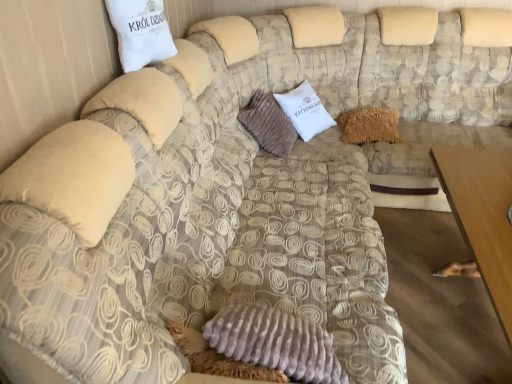
Question: Does fuzzy brown pillow at center, the third pillow in the left-to-right sequence, have a greater height compared to fuzzy brown pillow at center, the second pillow in the back-to-front sequence?

Choices:
 (A) yes
 (B) no

Answer: (B)

Question: Is fuzzy brown pillow at center, the third pillow in the left-to-right sequence, smaller than fuzzy brown pillow at center, the second pillow when ordered from front to back?

Choices:
 (A) no
 (B) yes

Answer: (B)

Question: From the image's perspective, is fuzzy brown pillow at center, the third pillow in the left-to-right sequence, on fuzzy brown pillow at center, arranged as the second pillow when viewed from the left?

Choices:
 (A) yes
 (B) no

Answer: (A)

Question: Is fuzzy brown pillow at center, the third pillow in the left-to-right sequence, shorter than fuzzy brown pillow at center, the second pillow when ordered from front to back?

Choices:
 (A) no
 (B) yes

Answer: (B)

Question: Is fuzzy brown pillow at center, the third pillow in the left-to-right sequence, wider than fuzzy brown pillow at center, the second pillow in the back-to-front sequence?

Choices:
 (A) no
 (B) yes

Answer: (B)

Question: Is fuzzy brown pillow at center, which appears as the 1th pillow when viewed from the back, in front of or behind white cotton pillow at upper left, which appears as the third pillow when viewed from the back, in the image?

Choices:
 (A) front
 (B) behind

Answer: (B)

Question: Based on their positions, is fuzzy brown pillow at center, the third pillow in the left-to-right sequence, located to the left or right of white cotton pillow at upper left, arranged as the 3th pillow when viewed from the right?

Choices:
 (A) left
 (B) right

Answer: (B)

Question: From a real-world perspective, relative to white cotton pillow at upper left, which appears as the third pillow when viewed from the back, is fuzzy brown pillow at center, the 3th pillow when ordered from front to back, vertically above or below?

Choices:
 (A) above
 (B) below

Answer: (B)

Question: Looking at the image, does fuzzy brown pillow at center, the 3th pillow when ordered from front to back, seem bigger or smaller compared to white cotton pillow at upper left, the first pillow from the front?

Choices:
 (A) big
 (B) small

Answer: (A)

Question: In terms of width, does fuzzy brown pillow at center, the 2th pillow from the right, look wider or thinner when compared to brown wooden table at lower right?

Choices:
 (A) wide
 (B) thin

Answer: (B)

Question: In terms of height, does fuzzy brown pillow at center, the 2th pillow from the right, look taller or shorter compared to brown wooden table at lower right?

Choices:
 (A) tall
 (B) short

Answer: (B)

Question: Is fuzzy brown pillow at center, the second pillow in the back-to-front sequence, inside the boundaries of brown wooden table at lower right, or outside?

Choices:
 (A) inside
 (B) outside

Answer: (B)

Question: From the image's perspective, is fuzzy brown pillow at center, the second pillow when ordered from front to back, above or below brown wooden table at lower right?

Choices:
 (A) below
 (B) above

Answer: (B)

Question: In terms of height, does fuzzy brown pillow at center, the 3th pillow when ordered from front to back, look taller or shorter compared to brown wooden table at lower right?

Choices:
 (A) tall
 (B) short

Answer: (B)

Question: Considering the positions of fuzzy brown pillow at center, which appears as the 1th pillow when viewed from the back, and brown wooden table at lower right in the image, is fuzzy brown pillow at center, which appears as the 1th pillow when viewed from the back, bigger or smaller than brown wooden table at lower right?

Choices:
 (A) small
 (B) big

Answer: (A)